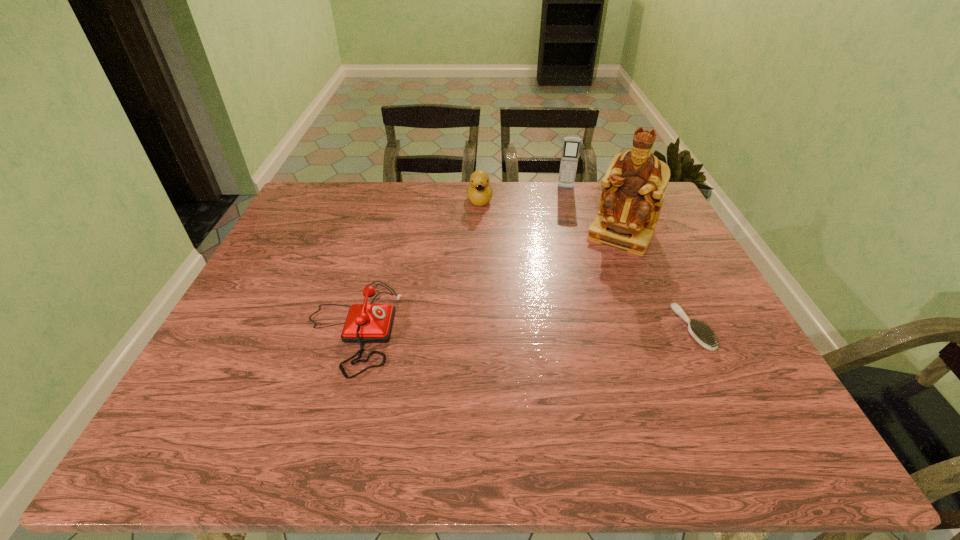
You are a GUI agent. You are given a task and a screenshot of the screen. Output one action in this format:
    pyautogui.click(x=<x>, y=<y>)
    Task: Click on the vacant space located on the front-facing side of the tallest object
    This screenshot has height=540, width=960.
    Given the screenshot: What is the action you would take?
    pyautogui.click(x=579, y=305)

Find the location of a particular element. vacant region located on the front-facing side of the tallest object is located at coordinates (587, 291).

Identify the location of free space located on the front-facing side of the tallest object. This screenshot has height=540, width=960. (579, 305).

Find the location of a particular element. free point located on the face of the duckling is located at coordinates (483, 247).

The width and height of the screenshot is (960, 540). Find the location of `blank space located on the face of the duckling`. blank space located on the face of the duckling is located at coordinates (488, 295).

I want to click on free space located 0.110m on the face of the duckling, so click(x=482, y=231).

Identify the location of vacant space located on the front-facing side of the cellular telephone. (563, 251).

Image resolution: width=960 pixels, height=540 pixels. Find the location of `free region located on the front-facing side of the cellular telephone`. free region located on the front-facing side of the cellular telephone is located at coordinates (564, 231).

Image resolution: width=960 pixels, height=540 pixels. Find the location of `vacant area situated on the front-facing side of the cellular telephone`. vacant area situated on the front-facing side of the cellular telephone is located at coordinates (564, 239).

This screenshot has height=540, width=960. Find the location of `figurine that is at the far edge`. figurine that is at the far edge is located at coordinates (633, 188).